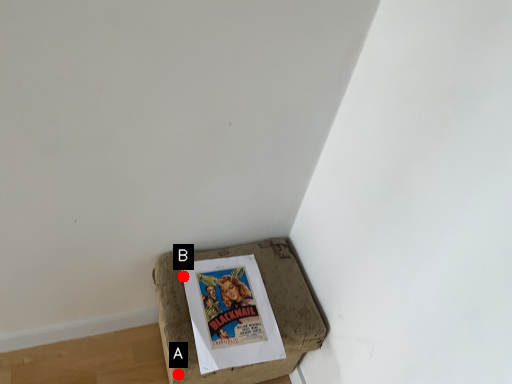
Question: Two points are circled on the image, labeled by A and B beside each circle. Which point is closer to the camera?

Choices:
 (A) A is closer
 (B) B is closer

Answer: (A)